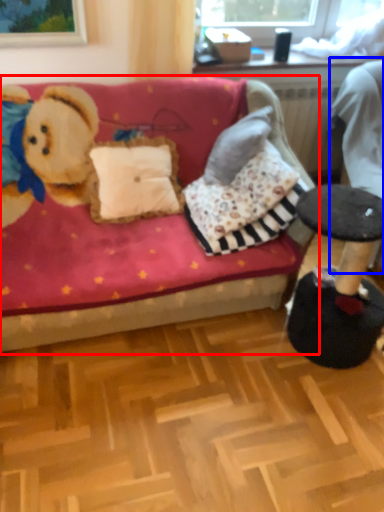
Question: Which object appears closest to the camera in this image, studio couch (highlighted by a red box) or swivel chair (highlighted by a blue box)?

Choices:
 (A) studio couch
 (B) swivel chair

Answer: (A)